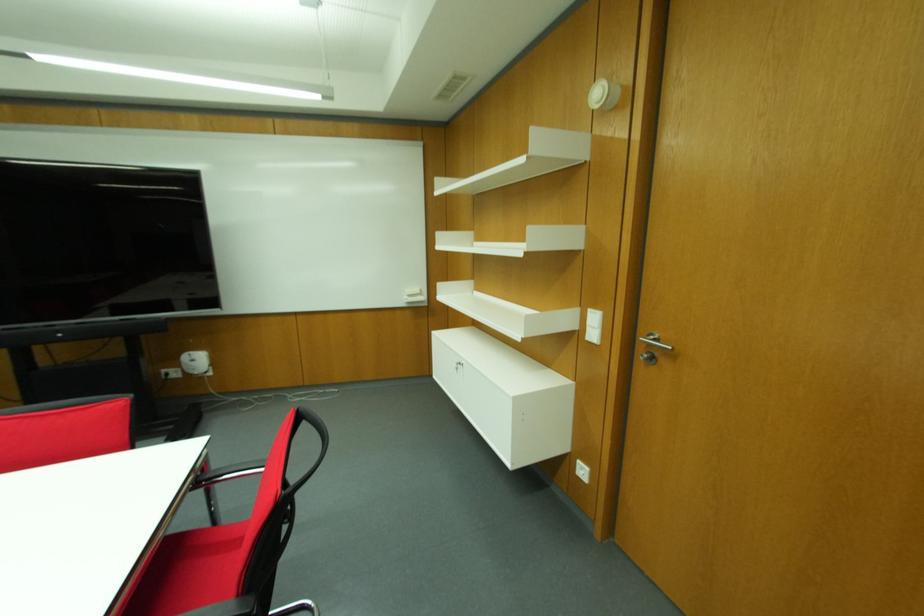
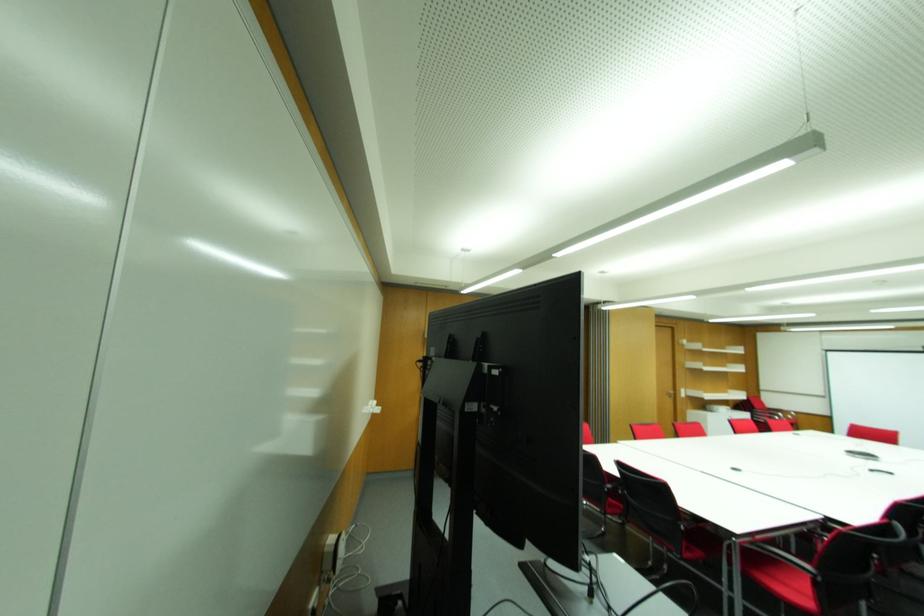
Question: I am providing you with two images of the same scene from different viewpoints. After the viewpoint changes to image2, which objects are now occluded?

Choices:
 (A) metal door handle
 (B) black chair armrest
 (C) hand dryer slot
 (D) red chair sitting surface

Answer: (D)